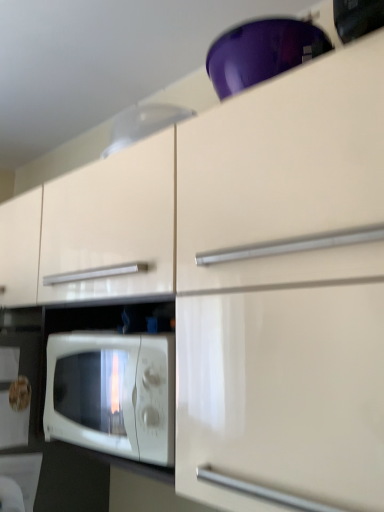
Question: Choose the correct answer: Is white glossy microwave oven at lower left inside white glossy exhaust hood at upper center or outside it?

Choices:
 (A) outside
 (B) inside

Answer: (A)

Question: Based on their sizes in the image, would you say white glossy microwave oven at lower left is bigger or smaller than white glossy exhaust hood at upper center?

Choices:
 (A) big
 (B) small

Answer: (A)

Question: From a real-world perspective, is white glossy microwave oven at lower left above or below white glossy exhaust hood at upper center?

Choices:
 (A) above
 (B) below

Answer: (B)

Question: Is white glossy exhaust hood at upper center to the left or to the right of white glossy microwave oven at lower left in the image?

Choices:
 (A) left
 (B) right

Answer: (B)

Question: In the image, is white glossy exhaust hood at upper center positioned in front of or behind white glossy microwave oven at lower left?

Choices:
 (A) front
 (B) behind

Answer: (B)

Question: Is point (135, 126) positioned closer to the camera than point (76, 394)?

Choices:
 (A) closer
 (B) farther

Answer: (B)

Question: Looking at the image, does white glossy exhaust hood at upper center seem bigger or smaller compared to white glossy microwave oven at lower left?

Choices:
 (A) small
 (B) big

Answer: (A)